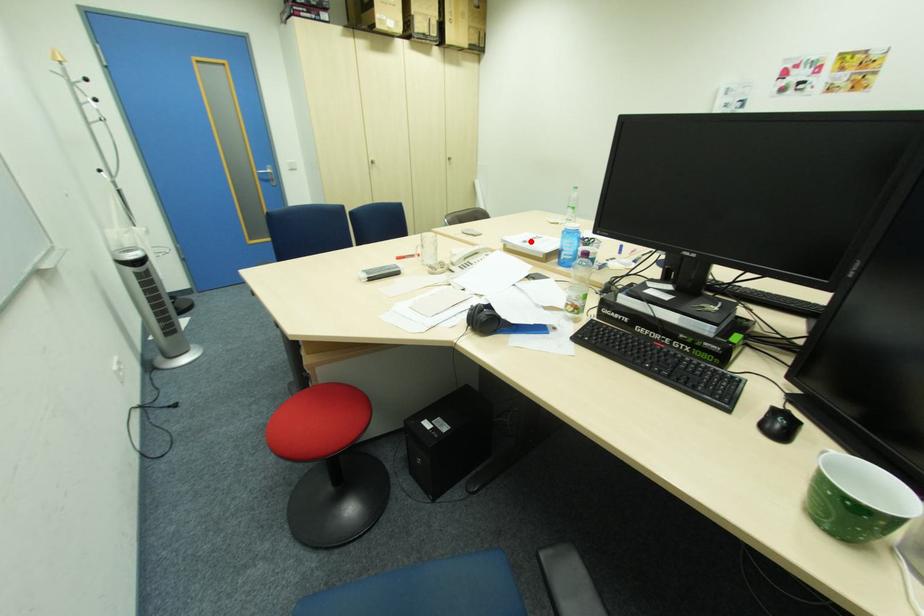
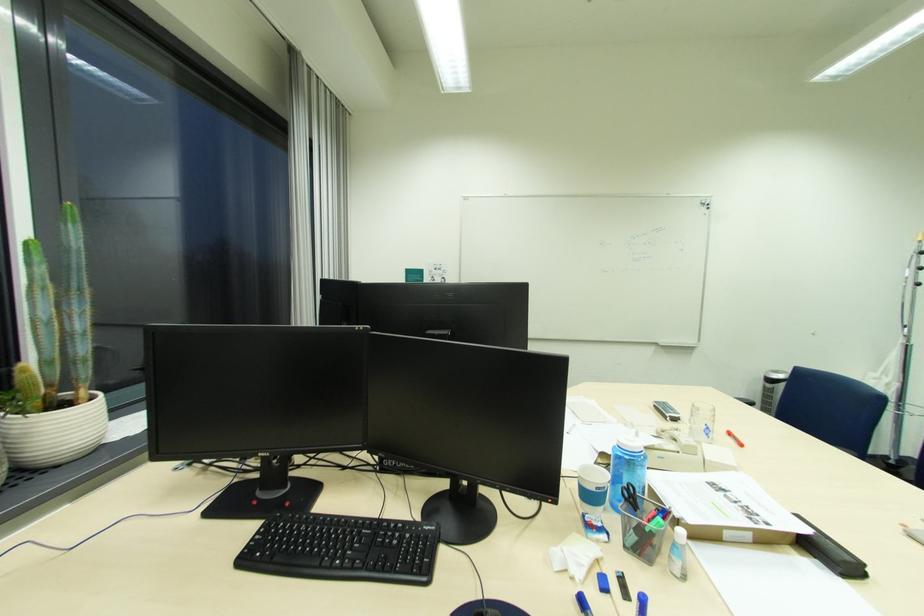
Locate, in the second image, the point that corresponds to the highlighted location in the first image.

(731, 491)